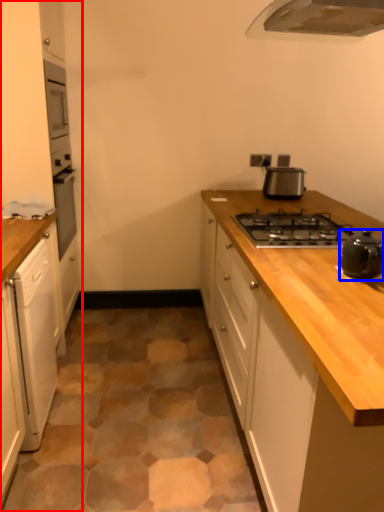
Question: Among these objects, which one is farthest to the camera, cabinetry (highlighted by a red box) or kitchen appliance (highlighted by a blue box)?

Choices:
 (A) cabinetry
 (B) kitchen appliance

Answer: (A)